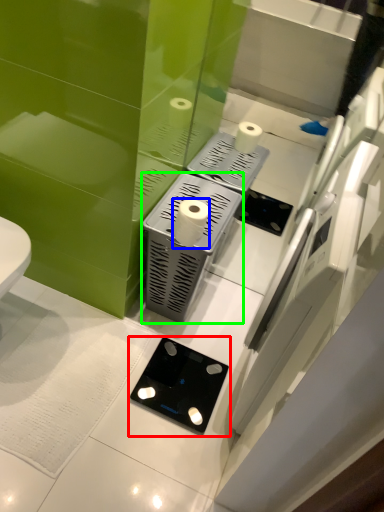
Question: Which object is positioned farthest from gadget (highlighted by a red box)? Select from toilet paper (highlighted by a blue box) and appliance (highlighted by a green box).

Choices:
 (A) toilet paper
 (B) appliance

Answer: (A)